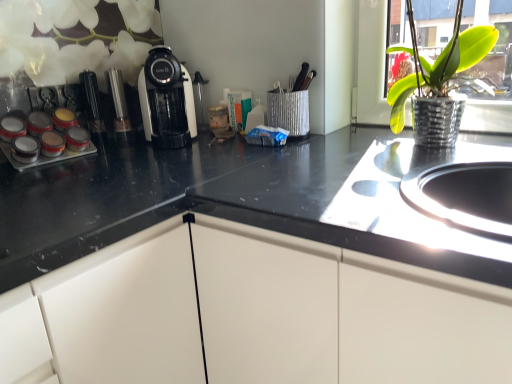
Question: Does white glossy coffee machine at center come behind green metallic pot at upper right?

Choices:
 (A) yes
 (B) no

Answer: (A)

Question: Does white glossy coffee machine at center touch green metallic pot at upper right?

Choices:
 (A) yes
 (B) no

Answer: (B)

Question: From a real-world perspective, is white glossy coffee machine at center physically above green metallic pot at upper right?

Choices:
 (A) yes
 (B) no

Answer: (B)

Question: Is white glossy coffee machine at center shorter than green metallic pot at upper right?

Choices:
 (A) no
 (B) yes

Answer: (B)

Question: Is white glossy coffee machine at center smaller than green metallic pot at upper right?

Choices:
 (A) yes
 (B) no

Answer: (A)

Question: Does white glossy coffee machine at center appear on the left side of green metallic pot at upper right?

Choices:
 (A) yes
 (B) no

Answer: (A)

Question: Are green metallic pot at upper right and white glossy coffee machine at center making contact?

Choices:
 (A) no
 (B) yes

Answer: (A)

Question: Does green metallic pot at upper right lie in front of white glossy coffee machine at center?

Choices:
 (A) yes
 (B) no

Answer: (A)

Question: Does green metallic pot at upper right have a lesser width compared to white glossy coffee machine at center?

Choices:
 (A) yes
 (B) no

Answer: (A)

Question: Is green metallic pot at upper right taller than white glossy coffee machine at center?

Choices:
 (A) yes
 (B) no

Answer: (A)

Question: From the image's perspective, is green metallic pot at upper right over white glossy coffee machine at center?

Choices:
 (A) yes
 (B) no

Answer: (B)

Question: Does green metallic pot at upper right turn towards white glossy coffee machine at center?

Choices:
 (A) yes
 (B) no

Answer: (B)

Question: Considering the relative positions of metallic silver spice rack at left and green metallic pot at upper right in the image provided, is metallic silver spice rack at left to the left of green metallic pot at upper right from the viewer's perspective?

Choices:
 (A) yes
 (B) no

Answer: (A)